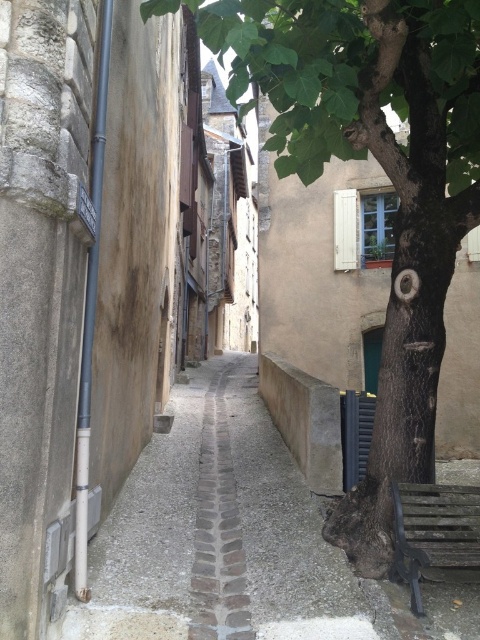
Question: Among these points, which one is farthest from the camera?

Choices:
 (A) (226, 497)
 (B) (362, 481)

Answer: (A)

Question: Does green rough bark tree at center come in front of gray cobblestone alley at center?

Choices:
 (A) yes
 (B) no

Answer: (B)

Question: Which of the following is the closest to the observer?

Choices:
 (A) (363, 528)
 (B) (210, 456)

Answer: (A)

Question: Does green rough bark tree at center appear on the left side of gray cobblestone alley at center?

Choices:
 (A) no
 (B) yes

Answer: (A)

Question: Among these objects, which one is farthest from the camera?

Choices:
 (A) green rough bark tree at center
 (B) gray cobblestone alley at center

Answer: (A)

Question: Does green rough bark tree at center lie behind gray cobblestone alley at center?

Choices:
 (A) no
 (B) yes

Answer: (B)